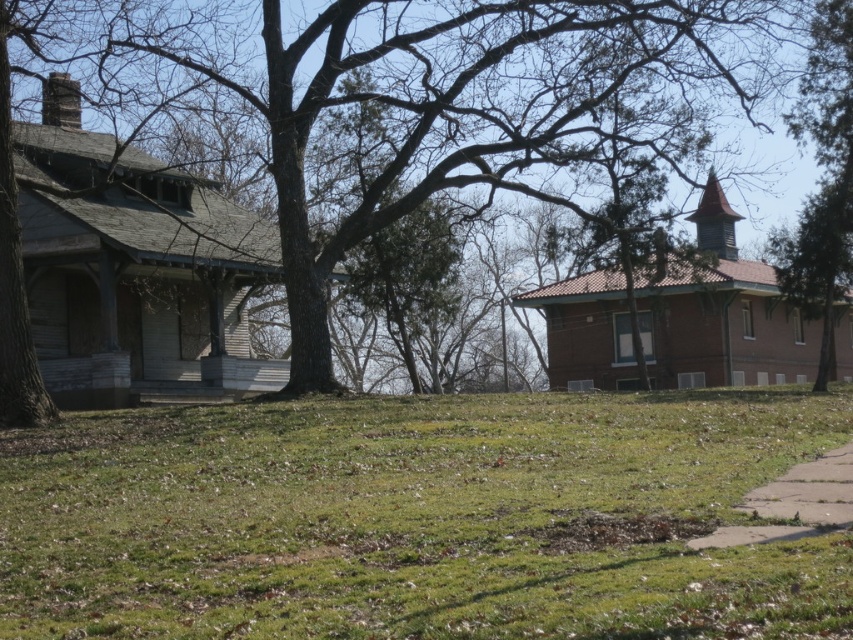
Is brown wood tree at center to the left of green textured tree at right from the viewer's perspective?

Indeed, brown wood tree at center is positioned on the left side of green textured tree at right.

Find the location of a particular element. The image size is (853, 640). brown wood tree at center is located at coordinates (434, 97).

Image resolution: width=853 pixels, height=640 pixels. In order to click on brown wood tree at center in this screenshot , I will do `click(434, 97)`.

Is point (210, 580) behind point (833, 515)?

No, (210, 580) is in front of (833, 515).

Does green grass at center lie in front of gray concrete sidewalk at lower right?

Yes, it is in front of gray concrete sidewalk at lower right.

The width and height of the screenshot is (853, 640). Identify the location of green grass at center. (416, 518).

Describe the element at coordinates (416, 518) in the screenshot. I see `green grass at center` at that location.

Who is more forward, (781,460) or (549,140)?

Point (781,460) is in front.

Which is behind, point (438, 618) or point (560, 196)?

Point (560, 196)

At what (x,y) coordinates should I click in order to perform the action: click on green grass at center. Please return your answer as a coordinate pair (x, y). The image size is (853, 640). Looking at the image, I should click on (416, 518).